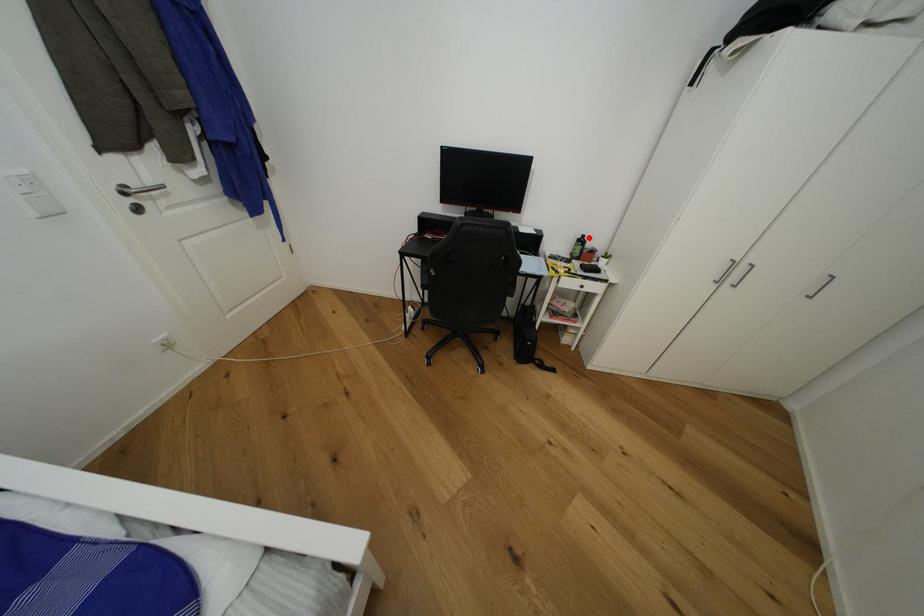
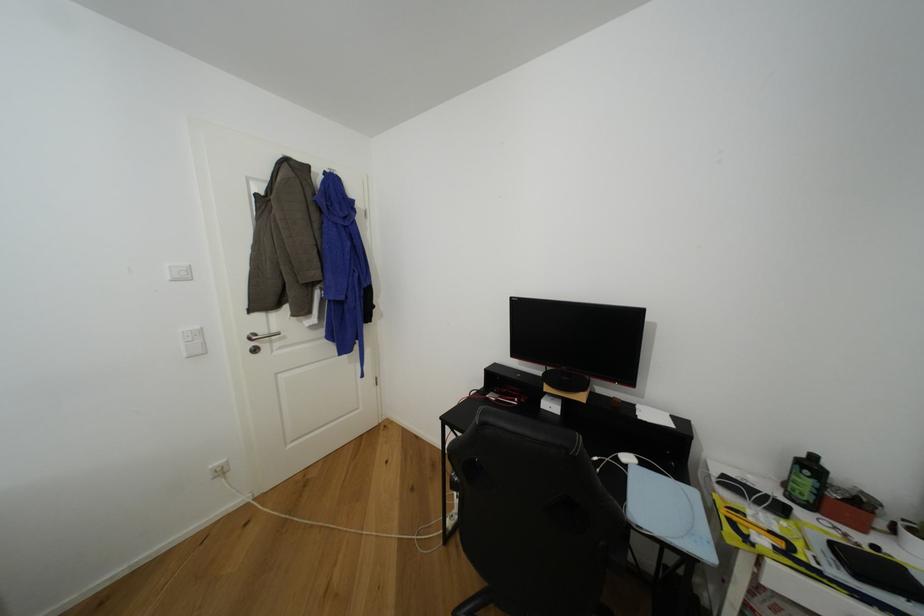
Question: A red point is marked in image1. In image2, is the corresponding 3D point closer to the camera or farther? Reply with the corresponding letter.

Choices:
 (A) The corresponding 3D point is closer.
 (B) The corresponding 3D point is farther.

Answer: (B)